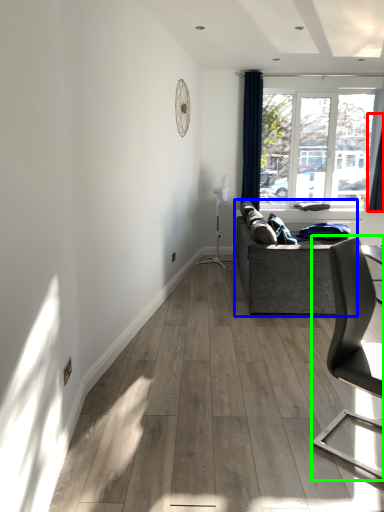
Question: Based on their relative distances, which object is farther from curtain (highlighted by a red box)? Choose from studio couch (highlighted by a blue box) and chair (highlighted by a green box).

Choices:
 (A) studio couch
 (B) chair

Answer: (B)